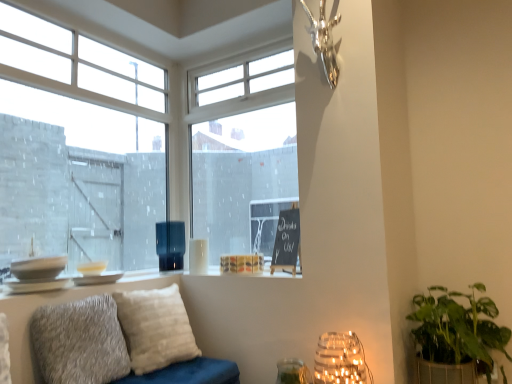
Question: Considering the relative positions of transparent glass window at center, which is the second window in left-to-right order, and green leafy plant in woven basket at lower right in the image provided, is transparent glass window at center, which is the second window in left-to-right order, to the right of green leafy plant in woven basket at lower right from the viewer's perspective?

Choices:
 (A) no
 (B) yes

Answer: (A)

Question: From a real-world perspective, does transparent glass window at center, which is the second window in left-to-right order, stand above green leafy plant in woven basket at lower right?

Choices:
 (A) yes
 (B) no

Answer: (A)

Question: Does transparent glass window at center, the first window positioned from the right, have a greater width compared to green leafy plant in woven basket at lower right?

Choices:
 (A) yes
 (B) no

Answer: (B)

Question: Is transparent glass window at center, the first window positioned from the right, closer to the viewer compared to green leafy plant in woven basket at lower right?

Choices:
 (A) yes
 (B) no

Answer: (B)

Question: Does transparent glass window at center, which is the second window in left-to-right order, have a lesser height compared to green leafy plant in woven basket at lower right?

Choices:
 (A) yes
 (B) no

Answer: (B)

Question: Is green leafy plant in woven basket at lower right wider or thinner than clear glass window at upper left, acting as the second window starting from the right?

Choices:
 (A) thin
 (B) wide

Answer: (B)

Question: In the image, is green leafy plant in woven basket at lower right on the left side or the right side of clear glass window at upper left, which is counted as the 1th window, starting from the left?

Choices:
 (A) right
 (B) left

Answer: (A)

Question: Considering their positions, is green leafy plant in woven basket at lower right located in front of or behind clear glass window at upper left, acting as the second window starting from the right?

Choices:
 (A) front
 (B) behind

Answer: (A)

Question: Considering the positions of point (453, 291) and point (15, 195), is point (453, 291) closer or farther from the camera than point (15, 195)?

Choices:
 (A) farther
 (B) closer

Answer: (B)

Question: Looking at the image, does fuzzy gray pillow at lower left, which is the first pillow in front-to-back order, seem bigger or smaller compared to white textured pillow at center, the 2th pillow from the front?

Choices:
 (A) small
 (B) big

Answer: (A)

Question: From the image's perspective, is fuzzy gray pillow at lower left, acting as the 2th pillow starting from the back, above or below white textured pillow at center, the first pillow in the back-to-front sequence?

Choices:
 (A) below
 (B) above

Answer: (B)

Question: Is fuzzy gray pillow at lower left, acting as the 2th pillow starting from the back, to the left or to the right of white textured pillow at center, the first pillow in the back-to-front sequence, in the image?

Choices:
 (A) right
 (B) left

Answer: (B)

Question: Is fuzzy gray pillow at lower left, acting as the 2th pillow starting from the back, wider or thinner than white textured pillow at center, the first pillow in the back-to-front sequence?

Choices:
 (A) thin
 (B) wide

Answer: (A)

Question: Looking at the image, does white textured pillow at center, the first pillow in the back-to-front sequence, seem bigger or smaller compared to matte black vase at center, which is the second lamp in right-to-left order?

Choices:
 (A) small
 (B) big

Answer: (B)

Question: From their relative heights in the image, would you say white textured pillow at center, the 2th pillow from the front, is taller or shorter than matte black vase at center, the 1th lamp positioned from the back?

Choices:
 (A) tall
 (B) short

Answer: (A)